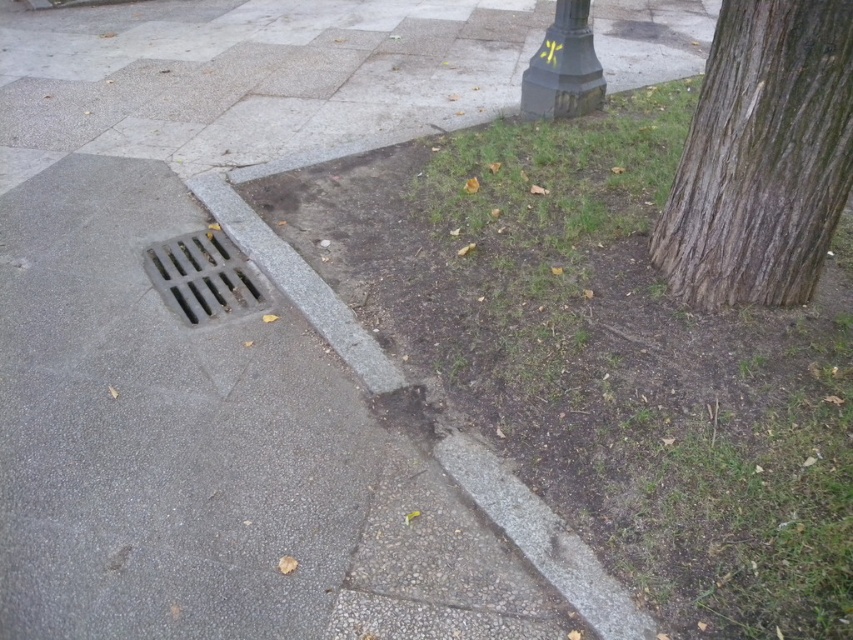
Question: Which of the following is the closest to the observer?

Choices:
 (A) (689, 305)
 (B) (523, 83)

Answer: (A)

Question: Does metallic grate at lower left have a smaller size compared to dark green textured pole at upper right?

Choices:
 (A) yes
 (B) no

Answer: (B)

Question: Which point is farther to the camera?

Choices:
 (A) (831, 60)
 (B) (572, 16)

Answer: (B)

Question: Which object appears farthest from the camera in this image?

Choices:
 (A) brown rough bark at right
 (B) metallic grate at lower left
 (C) dark green textured pole at upper right

Answer: (C)

Question: Does brown rough bark at right have a larger size compared to dark green textured pole at upper right?

Choices:
 (A) yes
 (B) no

Answer: (A)

Question: Is brown rough bark at right closer to the viewer compared to metallic grate at lower left?

Choices:
 (A) yes
 (B) no

Answer: (A)